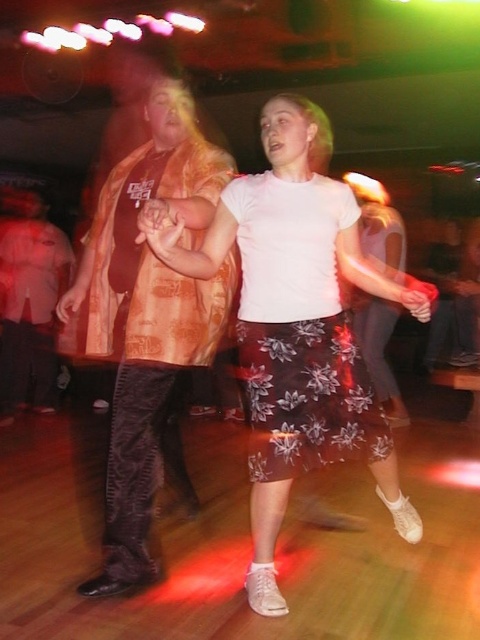
Question: Is orange patterned shirt at left closer to the viewer compared to matte orange shirt at left?

Choices:
 (A) yes
 (B) no

Answer: (A)

Question: Does white matte skirt at center come in front of matte orange shirt at left?

Choices:
 (A) no
 (B) yes

Answer: (B)

Question: Which of the following is the farthest from the observer?

Choices:
 (A) orange patterned shirt at left
 (B) matte orange shirt at left
 (C) white matte skirt at center

Answer: (B)

Question: Which object appears closest to the camera in this image?

Choices:
 (A) orange patterned shirt at left
 (B) brown floral skirt at center
 (C) white matte skirt at center

Answer: (C)

Question: Which object is positioned closest to the matte orange shirt at left?

Choices:
 (A) white matte skirt at center
 (B) orange patterned shirt at left

Answer: (B)

Question: Can you confirm if white matte skirt at center is wider than orange patterned shirt at left?

Choices:
 (A) no
 (B) yes

Answer: (B)